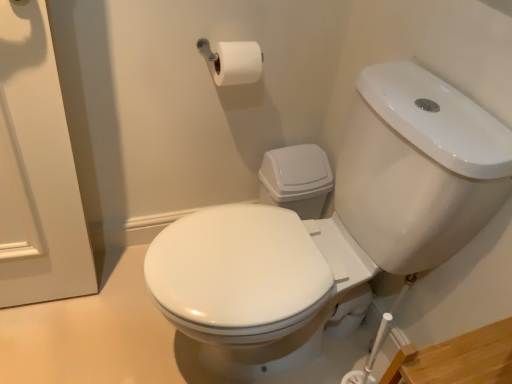
Question: Should I look upward or downward to see white glossy toilet at center?

Choices:
 (A) up
 (B) down

Answer: (B)

Question: From a real-world perspective, is white glossy toilet at center below white matte toilet paper at upper center?

Choices:
 (A) yes
 (B) no

Answer: (A)

Question: Considering the relative sizes of white glossy toilet at center and white matte toilet paper at upper center in the image provided, is white glossy toilet at center smaller than white matte toilet paper at upper center?

Choices:
 (A) yes
 (B) no

Answer: (B)

Question: Is white glossy toilet at center oriented towards white matte toilet paper at upper center?

Choices:
 (A) no
 (B) yes

Answer: (A)

Question: Is white glossy toilet at center not inside white matte toilet paper at upper center?

Choices:
 (A) no
 (B) yes

Answer: (B)

Question: From the image's perspective, is white glossy toilet at center located beneath white matte toilet paper at upper center?

Choices:
 (A) no
 (B) yes

Answer: (B)

Question: Is white glossy toilet at center positioned in front of white matte toilet paper at upper center?

Choices:
 (A) no
 (B) yes

Answer: (B)

Question: Can you confirm if white matte toilet paper at upper center is thinner than white glossy toilet at center?

Choices:
 (A) yes
 (B) no

Answer: (A)

Question: Does white matte toilet paper at upper center have a smaller size compared to white glossy toilet at center?

Choices:
 (A) no
 (B) yes

Answer: (B)

Question: Does white matte toilet paper at upper center have a lesser height compared to white glossy toilet at center?

Choices:
 (A) no
 (B) yes

Answer: (B)

Question: Can you confirm if white matte toilet paper at upper center is positioned to the right of white glossy toilet at center?

Choices:
 (A) yes
 (B) no

Answer: (B)

Question: Does white matte toilet paper at upper center appear on the left side of white glossy toilet at center?

Choices:
 (A) yes
 (B) no

Answer: (A)

Question: From the image's perspective, is white matte toilet paper at upper center on white glossy toilet at center?

Choices:
 (A) yes
 (B) no

Answer: (A)

Question: Is white glossy toilet at center wider or thinner than white matte toilet paper at upper center?

Choices:
 (A) wide
 (B) thin

Answer: (A)